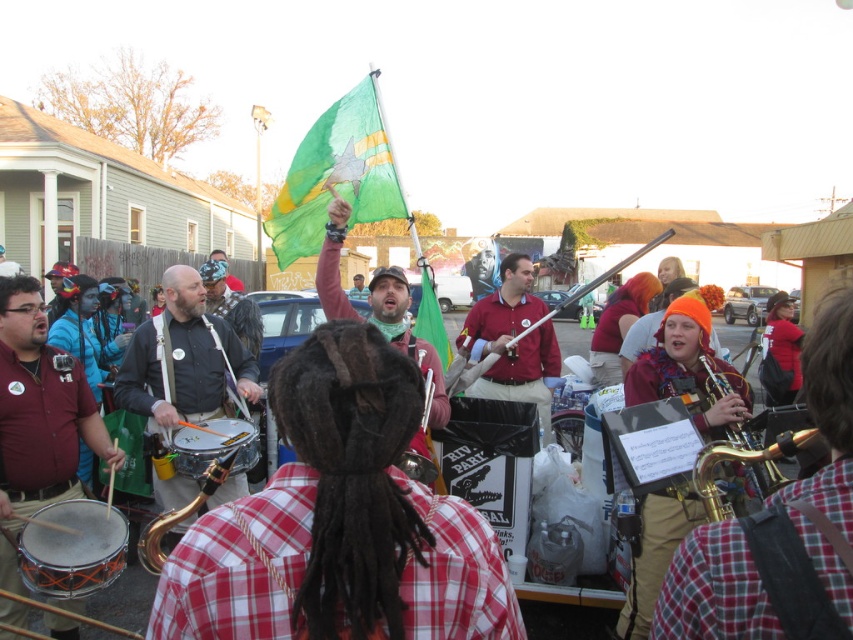
You are a photographer trying to capture the green fabric flag at upper center and the matte black drum at lower left in the same frame. Based on their positions, which object should you focus on first to ensure both are in the frame?

The green fabric flag at upper center is above the matte black drum at lower left, so you should focus on the matte black drum at lower left first to ensure both are in the frame.

You are a performer carrying a 1.5 meter long instrument case. You need to move from the maroon shirt at center to the gold brass saxophone at lower right. Is there enough space to move the case without tilting it?

The distance between maroon shirt at center and gold brass saxophone at lower right is 2.24 meters. Since the instrument case is 1.5 meters long, there is sufficient space to move it without tilting.

You are a photographer trying to capture the entire scene in one shot. You notice the green fabric flag at upper center and the matte black drum at lower left. Which object should you focus on first if you want to ensure both are in frame without moving the camera?

The green fabric flag at upper center is bigger than the matte black drum at lower left, so focusing on the larger green fabric flag at upper center first will help ensure both objects fit within the frame.